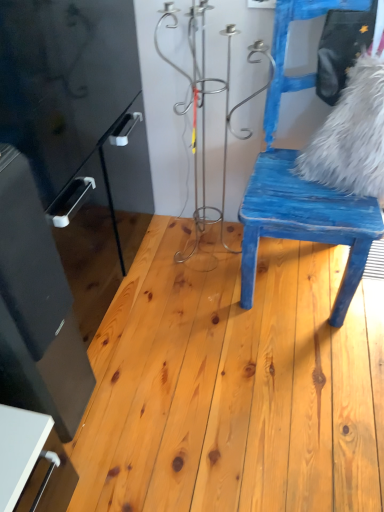
Question: Does white fluffy pillow at upper right turn towards blue distressed wood chair at right?

Choices:
 (A) no
 (B) yes

Answer: (B)

Question: Is white fluffy pillow at upper right oriented away from blue distressed wood chair at right?

Choices:
 (A) no
 (B) yes

Answer: (B)

Question: Is white fluffy pillow at upper right taller than blue distressed wood chair at right?

Choices:
 (A) yes
 (B) no

Answer: (B)

Question: Is white fluffy pillow at upper right positioned beyond the bounds of blue distressed wood chair at right?

Choices:
 (A) yes
 (B) no

Answer: (B)

Question: Considering the relative sizes of white fluffy pillow at upper right and blue distressed wood chair at right in the image provided, is white fluffy pillow at upper right shorter than blue distressed wood chair at right?

Choices:
 (A) no
 (B) yes

Answer: (B)

Question: From the image's perspective, is white fluffy pillow at upper right on blue distressed wood chair at right?

Choices:
 (A) no
 (B) yes

Answer: (B)

Question: Is blue distressed wood chair at right not inside white fluffy pillow at upper right?

Choices:
 (A) no
 (B) yes

Answer: (B)

Question: Is blue distressed wood chair at right far away from white fluffy pillow at upper right?

Choices:
 (A) yes
 (B) no

Answer: (B)

Question: Can you confirm if blue distressed wood chair at right is smaller than white fluffy pillow at upper right?

Choices:
 (A) no
 (B) yes

Answer: (A)

Question: Does blue distressed wood chair at right come behind white fluffy pillow at upper right?

Choices:
 (A) yes
 (B) no

Answer: (B)

Question: Would you say white fluffy pillow at upper right is part of blue distressed wood chair at right's contents?

Choices:
 (A) no
 (B) yes

Answer: (B)

Question: Is blue distressed wood chair at right facing away from white fluffy pillow at upper right?

Choices:
 (A) no
 (B) yes

Answer: (B)

Question: Is blue distressed wood chair at right located outside natural wood floor at center?

Choices:
 (A) yes
 (B) no

Answer: (A)